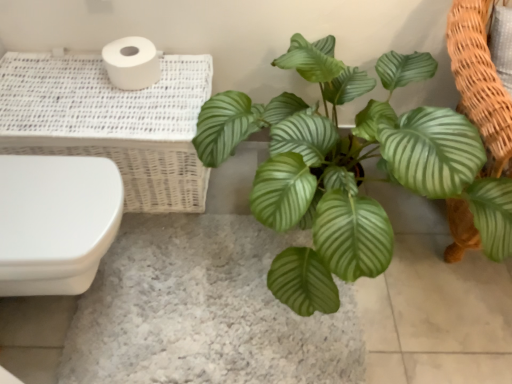
Where is `free space above white glossy toilet at left (from a real-world perspective)`? This screenshot has width=512, height=384. free space above white glossy toilet at left (from a real-world perspective) is located at coordinates (47, 198).